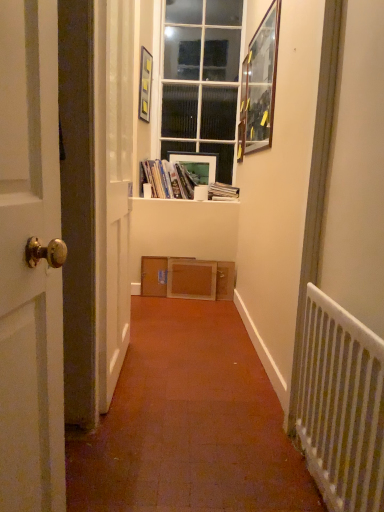
Question: Does point (236, 190) appear closer or farther from the camera than point (140, 89)?

Choices:
 (A) closer
 (B) farther

Answer: (A)

Question: Is hardcover book at center inside or outside of matte glass picture frame at upper center, the second picture frame positioned from the front?

Choices:
 (A) outside
 (B) inside

Answer: (A)

Question: Estimate the real-world distances between objects in this image. Which object is closer to the white glass window at center?

Choices:
 (A) matte glass picture frame at upper center, the second picture frame positioned from the front
 (B) transparent glass screen door at left
 (C) hardcover book at center
 (D) white cardboard at center
 (E) matte plastic books at center

Answer: (A)

Question: Estimate the real-world distances between objects in this image. Which object is farther from the white wooden door at left?

Choices:
 (A) transparent glass screen door at left
 (B) wooden-framed mirror at upper right, placed as the third picture frame when sorted from left to right
 (C) matte white picture frame at center, which is counted as the second picture frame, starting from the right
 (D) white cardboard at center
 (E) matte glass picture frame at upper center, the second picture frame when ordered from back to front

Answer: (E)